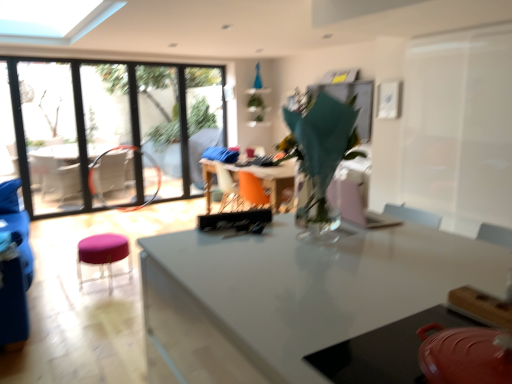
This screenshot has width=512, height=384. Identify the location of vacant point above transparent plastic screen door at right (from a real-world perspective). (446, 28).